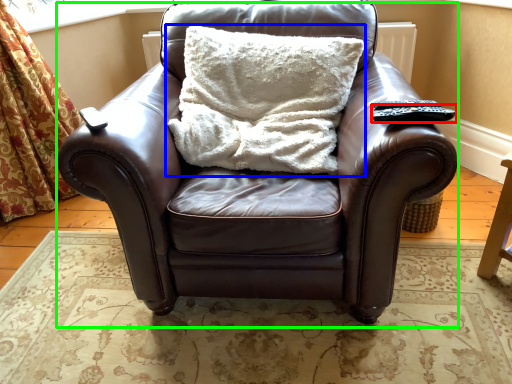
Question: Which object is positioned farthest from remote (highlighted by a red box)? Select from pillow (highlighted by a blue box) and chair (highlighted by a green box).

Choices:
 (A) pillow
 (B) chair

Answer: (B)